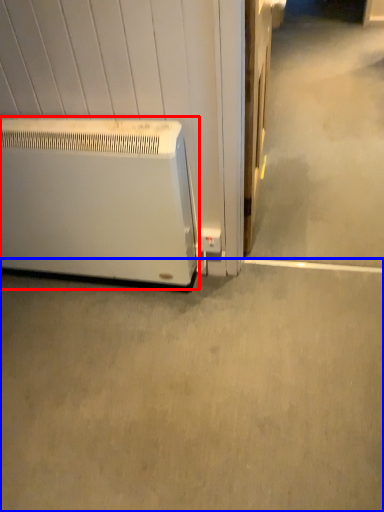
Question: Which object is further to the camera taking this photo, home appliance (highlighted by a red box) or concrete (highlighted by a blue box)?

Choices:
 (A) home appliance
 (B) concrete

Answer: (A)